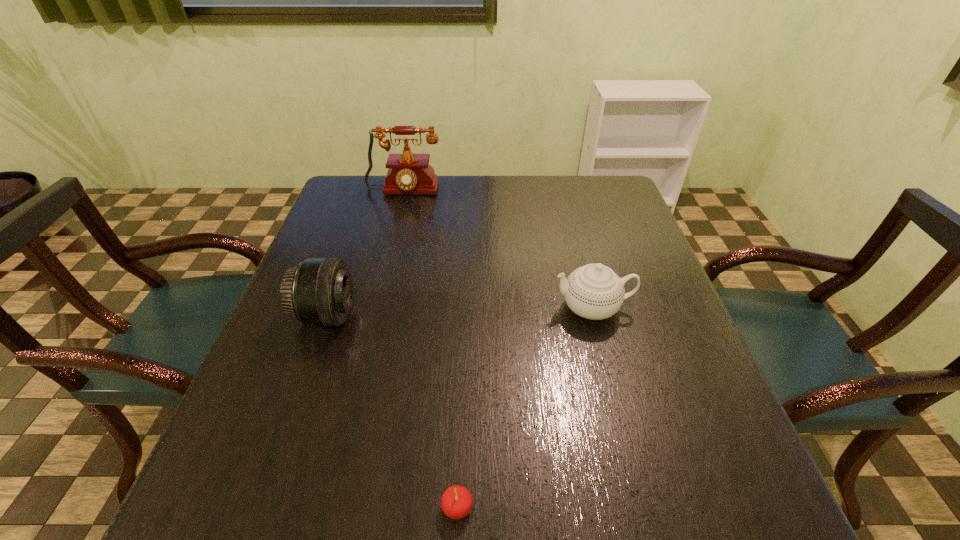
In the image, there is a desktop. In order to click on vacant space at the left edge in this screenshot , I will do click(285, 351).

In the image, there is a desktop. In order to click on free space at the right edge in this screenshot , I will do `click(665, 284)`.

I want to click on vacant space at the far right corner of the desktop, so click(x=604, y=191).

Where is `empty space that is in between the telephoto lens and the telephone`? The width and height of the screenshot is (960, 540). empty space that is in between the telephoto lens and the telephone is located at coordinates (365, 254).

The height and width of the screenshot is (540, 960). In order to click on free spot between the second object from right to left and the tallest object in this screenshot , I will do `click(430, 350)`.

Locate an element on the screen. free space between the cherry and the tallest object is located at coordinates (430, 350).

The height and width of the screenshot is (540, 960). Find the location of `free point between the telephone and the third object from left to right`. free point between the telephone and the third object from left to right is located at coordinates (430, 350).

Locate an element on the screen. The image size is (960, 540). vacant space that's between the rightmost object and the tallest object is located at coordinates (497, 250).

I want to click on vacant space that is in between the farthest object and the telephoto lens, so click(365, 254).

The width and height of the screenshot is (960, 540). Identify the location of free point between the tallest object and the chinaware. (497, 250).